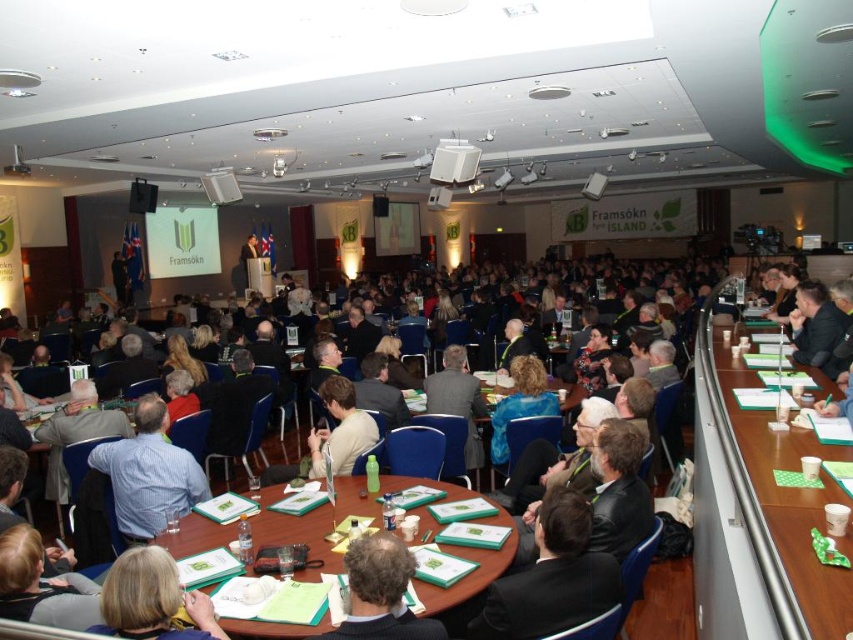
Consider the image. You are standing at the entrance of the conference room and want to place a new attendee at point (758, 516). What object is located there?

The green plastic table at right is located at point (758, 516).

You are an attendee at the conference and need to place your smooth paper folder at center onto the green plastic table at right. Can you do this without moving any other objects? Explain why based on their positions.

The green plastic table at right is closer to the viewer than the smooth paper folder at center, so you can reach the table first and place the folder there without needing to move other objects.